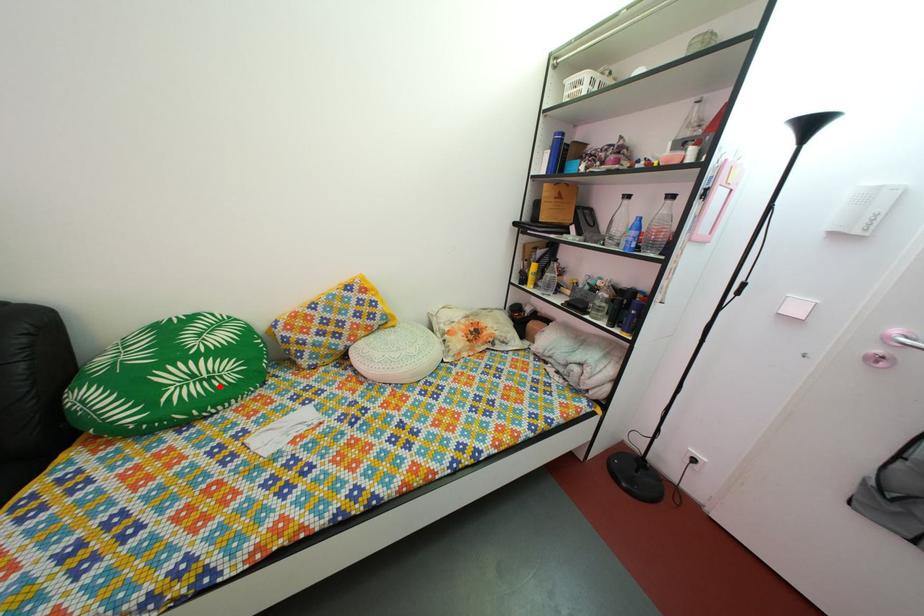
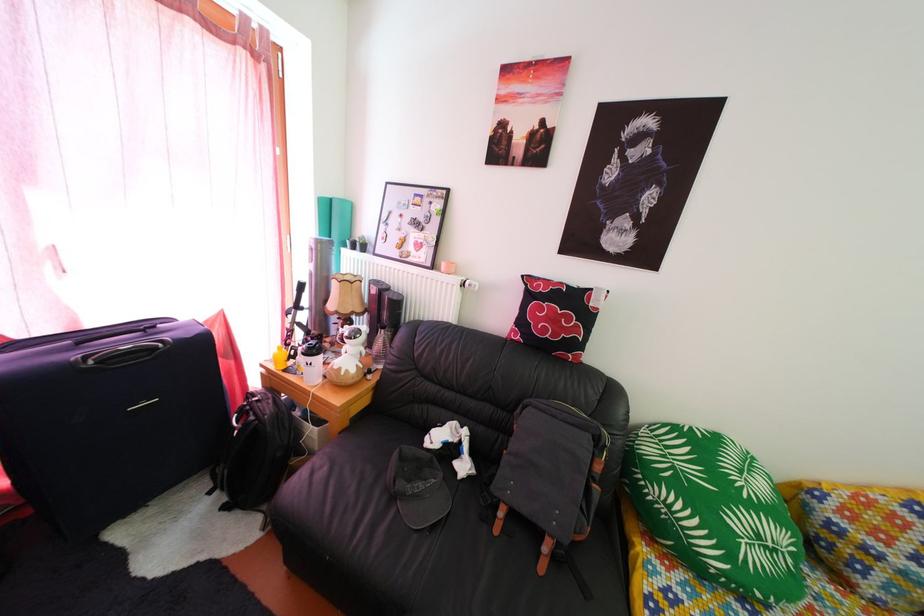
Where in the second image is the point corresponding to the highlighted location from the first image?

(784, 560)